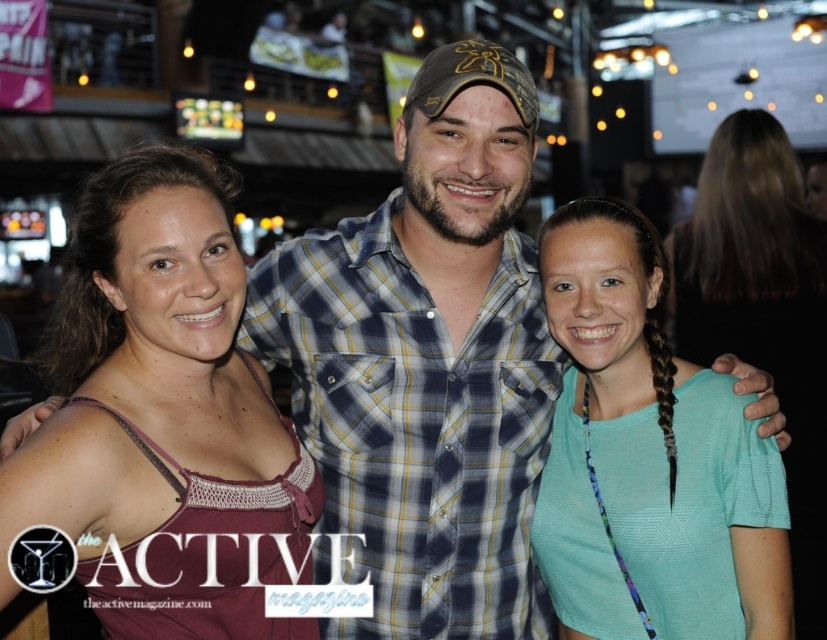
Does teal fabric shirt at right have a larger size compared to teal fabric shirt at center?

No.

Who is higher up, teal fabric shirt at right or teal fabric shirt at center?

Positioned higher is teal fabric shirt at right.

Describe the element at coordinates (644, 449) in the screenshot. I see `teal fabric shirt at right` at that location.

The image size is (827, 640). In order to click on teal fabric shirt at right in this screenshot , I will do `click(644, 449)`.

Is matte purple tank top at left behind teal fabric shirt at center?

That is False.

Between point (118, 445) and point (780, 262), which one is positioned behind?

Point (780, 262)

Between point (5, 573) and point (808, 460), which one is positioned in front?

Positioned in front is point (5, 573).

Where is `matte purple tank top at left`? matte purple tank top at left is located at coordinates (165, 410).

What do you see at coordinates (165, 410) in the screenshot? The width and height of the screenshot is (827, 640). I see `matte purple tank top at left` at bounding box center [165, 410].

Is matte purple tank top at left smaller than teal fabric shirt at right?

Actually, matte purple tank top at left might be larger than teal fabric shirt at right.

Image resolution: width=827 pixels, height=640 pixels. What are the coordinates of `matte purple tank top at left` in the screenshot? It's located at (165, 410).

Find the location of a particular element. matte purple tank top at left is located at coordinates (165, 410).